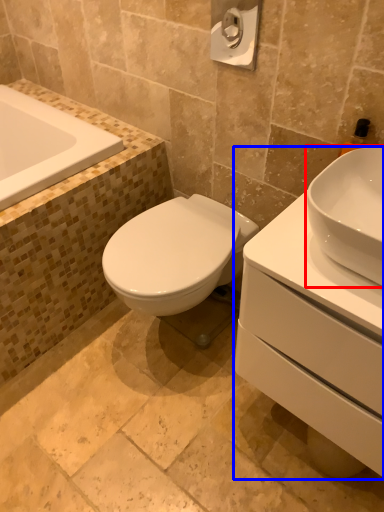
Question: Which of the following is the farthest to the observer, sink (highlighted by a red box) or porcelain (highlighted by a blue box)?

Choices:
 (A) sink
 (B) porcelain

Answer: (A)